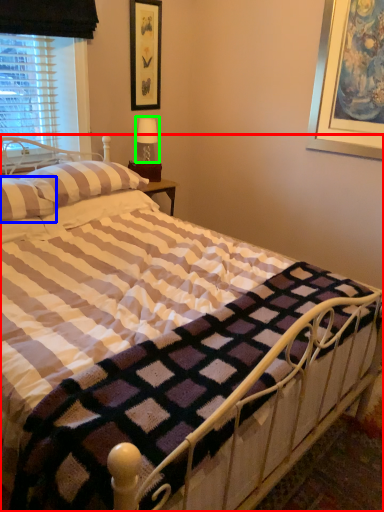
Question: Estimate the real-world distances between objects in this image. Which object is farther from bed (highlighted by a red box), pillow (highlighted by a blue box) or table lamp (highlighted by a green box)?

Choices:
 (A) pillow
 (B) table lamp

Answer: (B)